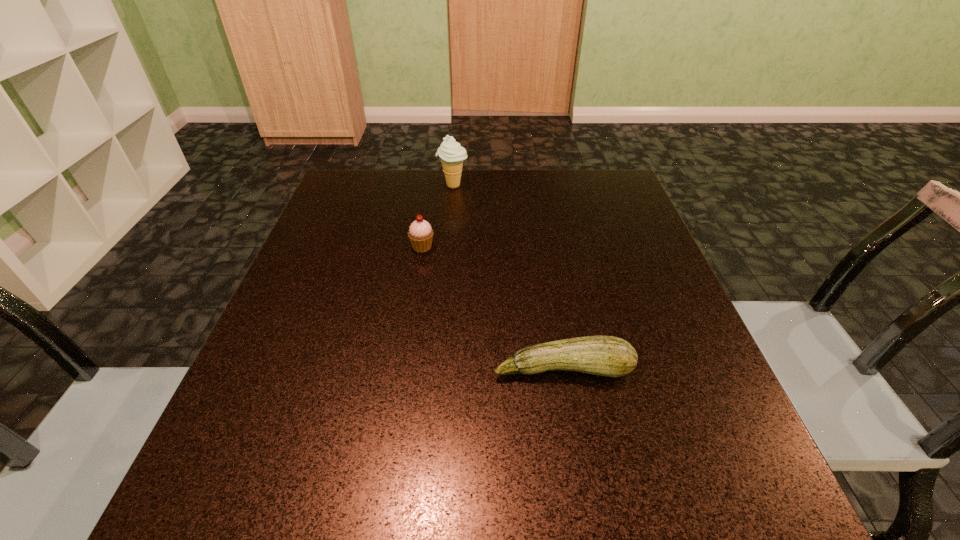
Where is `unoccupied area between the icecream and the shortest object`? The width and height of the screenshot is (960, 540). unoccupied area between the icecream and the shortest object is located at coordinates (508, 277).

This screenshot has width=960, height=540. I want to click on free space between the tallest object and the nearest object, so click(x=508, y=277).

Where is `vacant point located between the zucchini and the farthest object`? The image size is (960, 540). vacant point located between the zucchini and the farthest object is located at coordinates (508, 277).

This screenshot has height=540, width=960. Find the location of `vacant region between the nearest object and the cupcake`. vacant region between the nearest object and the cupcake is located at coordinates (492, 308).

This screenshot has width=960, height=540. Identify the location of vacant space that's between the tallest object and the nearest object. (508, 277).

Image resolution: width=960 pixels, height=540 pixels. Identify the location of free space between the second shortest object and the farthest object. (x=438, y=216).

At what (x,y) coordinates should I click in order to perform the action: click on empty space between the icecream and the second shortest object. Please return your answer as a coordinate pair (x, y). Image resolution: width=960 pixels, height=540 pixels. Looking at the image, I should click on (438, 216).

Locate an element on the screen. the second closest object to the nearest object is located at coordinates (451, 153).

Locate an element on the screen. the closest object to the farthest object is located at coordinates (420, 234).

What are the coordinates of `vacant space that satisfies the following two spatial constraints: 1. on the back side of the tallest object; 2. on the left side of the cupcake` in the screenshot? It's located at (432, 186).